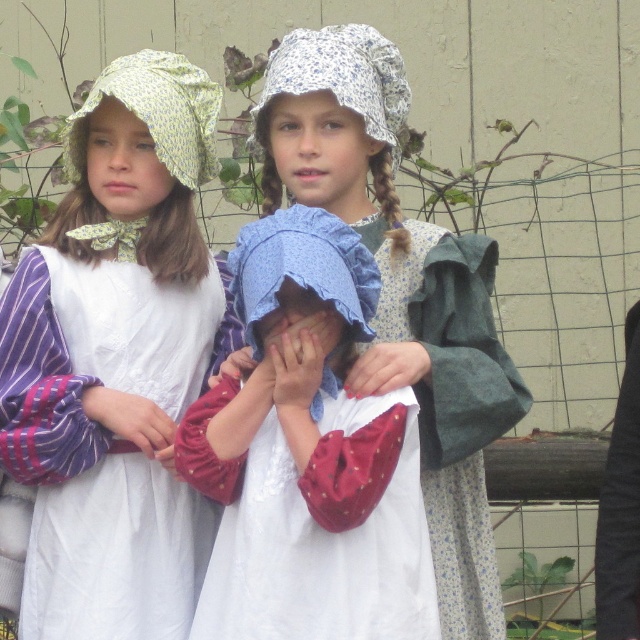
How far apart are matte yellow bonnet at left and blue cotton bonnet at center?

matte yellow bonnet at left is 35.84 inches from blue cotton bonnet at center.

Is point (54, 566) in front of point (458, 374)?

No, (54, 566) is further to viewer.

Where is `matte yellow bonnet at left`? The height and width of the screenshot is (640, 640). matte yellow bonnet at left is located at coordinates (115, 358).

Is white cotton dress at center above smooth skin hand at center?

Incorrect, white cotton dress at center is not positioned above smooth skin hand at center.

Based on the photo, is white cotton dress at center further to the viewer compared to smooth skin hand at center?

No, it is in front of smooth skin hand at center.

Describe the element at coordinates (308, 460) in the screenshot. I see `white cotton dress at center` at that location.

This screenshot has width=640, height=640. Identify the location of white cotton dress at center. pyautogui.click(x=308, y=460).

Can you confirm if smooth red fabric at center is wider than smooth skin hand at center?

Yes, smooth red fabric at center is wider than smooth skin hand at center.

Can you confirm if smooth red fabric at center is positioned above smooth skin hand at center?

No, smooth red fabric at center is not above smooth skin hand at center.

Is point (97, 419) less distant than point (273, 340)?

That is False.

Locate an element on the screen. This screenshot has height=640, width=640. smooth red fabric at center is located at coordinates (132, 420).